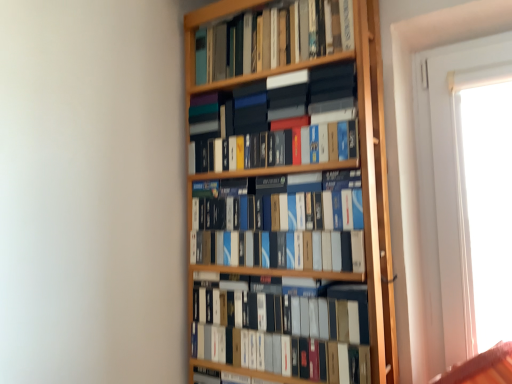
Question: Is hardcover books at upper center, which is the 1th book in top-to-bottom order, to the right of matte black books at center, the third book positioned from the bottom, from the viewer's perspective?

Choices:
 (A) yes
 (B) no

Answer: (A)

Question: Considering the relative positions of hardcover books at upper center, which is the 1th book in top-to-bottom order, and matte black books at center, the 2th book when ordered from top to bottom, in the image provided, is hardcover books at upper center, which is the 1th book in top-to-bottom order, to the left of matte black books at center, the 2th book when ordered from top to bottom, from the viewer's perspective?

Choices:
 (A) no
 (B) yes

Answer: (A)

Question: Is hardcover books at upper center, which is the 1th book in top-to-bottom order, facing away from matte black books at center, the third book positioned from the bottom?

Choices:
 (A) no
 (B) yes

Answer: (A)

Question: Can you confirm if hardcover books at upper center, marked as the 4th book in a bottom-to-top arrangement, is smaller than matte black books at center, the third book positioned from the bottom?

Choices:
 (A) yes
 (B) no

Answer: (A)

Question: From the image's perspective, is hardcover books at upper center, which is the 1th book in top-to-bottom order, located above matte black books at center, the 2th book when ordered from top to bottom?

Choices:
 (A) no
 (B) yes

Answer: (B)

Question: From a real-world perspective, relative to blue matte book at center, which is the 3th book in top-to-bottom order, is matte black box at center, positioned as the first book in bottom-to-top order, vertically above or below?

Choices:
 (A) above
 (B) below

Answer: (B)

Question: In terms of width, does matte black box at center, positioned as the first book in bottom-to-top order, look wider or thinner when compared to blue matte book at center, which is the 3th book in top-to-bottom order?

Choices:
 (A) thin
 (B) wide

Answer: (A)

Question: Relative to blue matte book at center, the second book from the bottom, is matte black box at center, positioned as the first book in bottom-to-top order, in front or behind?

Choices:
 (A) behind
 (B) front

Answer: (B)

Question: From the image's perspective, is matte black box at center, positioned as the first book in bottom-to-top order, positioned above or below blue matte book at center, the second book from the bottom?

Choices:
 (A) below
 (B) above

Answer: (A)

Question: Is blue matte book at center, the second book from the bottom, in front of or behind hardcover books at upper center, marked as the 4th book in a bottom-to-top arrangement, in the image?

Choices:
 (A) front
 (B) behind

Answer: (A)

Question: Is blue matte book at center, the second book from the bottom, situated inside hardcover books at upper center, marked as the 4th book in a bottom-to-top arrangement, or outside?

Choices:
 (A) outside
 (B) inside

Answer: (A)

Question: Does point (259, 226) appear closer or farther from the camera than point (220, 48)?

Choices:
 (A) closer
 (B) farther

Answer: (A)

Question: Is blue matte book at center, the second book from the bottom, wider or thinner than hardcover books at upper center, which is the 1th book in top-to-bottom order?

Choices:
 (A) thin
 (B) wide

Answer: (B)

Question: In terms of size, does hardcover books at upper center, which is the 1th book in top-to-bottom order, appear bigger or smaller than matte black box at center, the 4th book positioned from the top?

Choices:
 (A) small
 (B) big

Answer: (A)

Question: Is point (209, 31) positioned closer to the camera than point (253, 291)?

Choices:
 (A) closer
 (B) farther

Answer: (B)